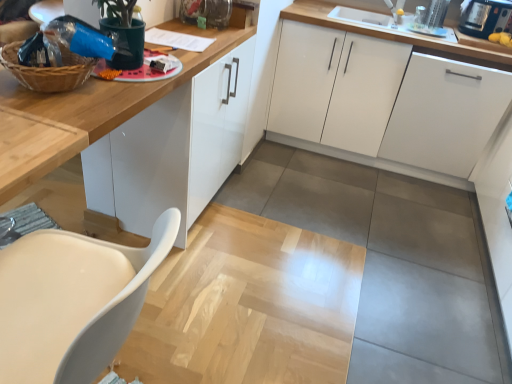
At what (x,y) coordinates should I click in order to perform the action: click on empty space that is ontop of white glossy cabinet at upper center, the 3th cabinetry when ordered from right to left (from a real-world perspective). Please return your answer as a coordinate pair (x, y). This screenshot has height=384, width=512. Looking at the image, I should click on (185, 44).